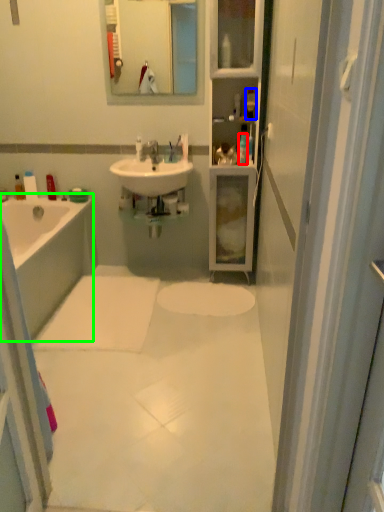
Question: Which is nearer to the toiletry (highlighted by a red box)? toiletry (highlighted by a blue box) or bathtub (highlighted by a green box).

Choices:
 (A) toiletry
 (B) bathtub

Answer: (A)